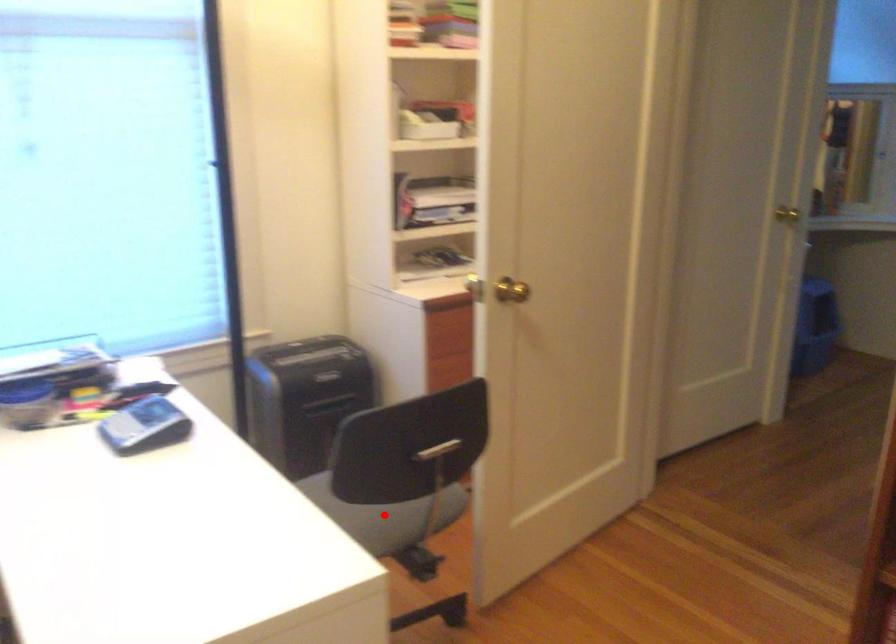
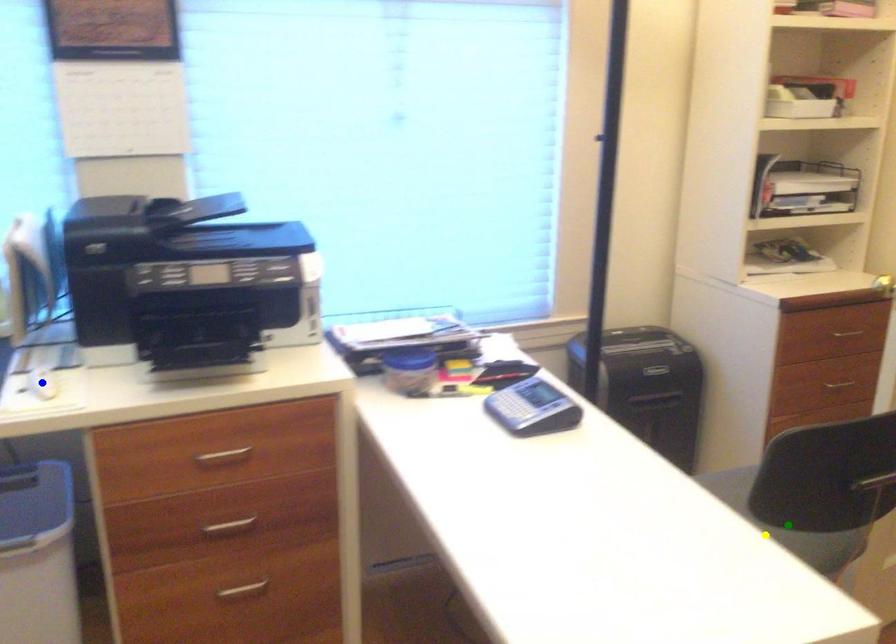
Question: I am providing you with two images of the same scene from different viewpoints. A red point is marked on the first image. You are given multiple points on the second image. Can you choose the point in image 2 that corresponds to the point in image 1?

Choices:
 (A) blue point
 (B) green point
 (C) yellow point

Answer: (C)